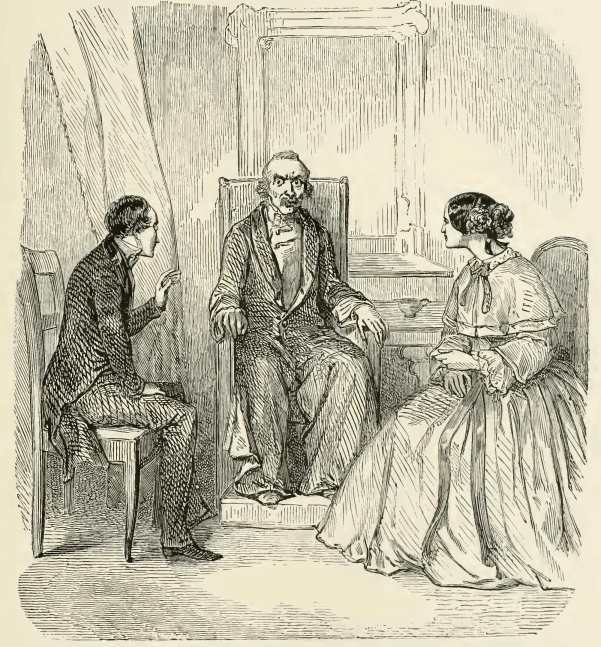
Locate an element on the screen. The height and width of the screenshot is (647, 601). teacup is located at coordinates (415, 307).